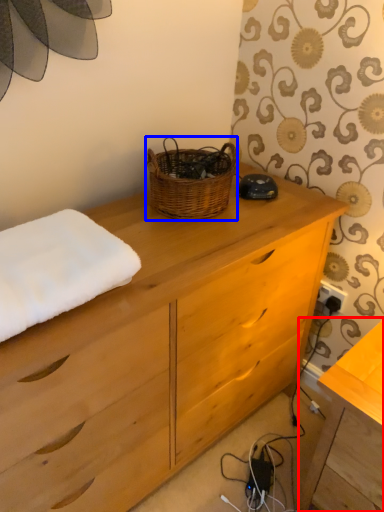
Question: Which of the following is the farthest to the observer, table (highlighted by a red box) or picnic basket (highlighted by a blue box)?

Choices:
 (A) table
 (B) picnic basket

Answer: (B)